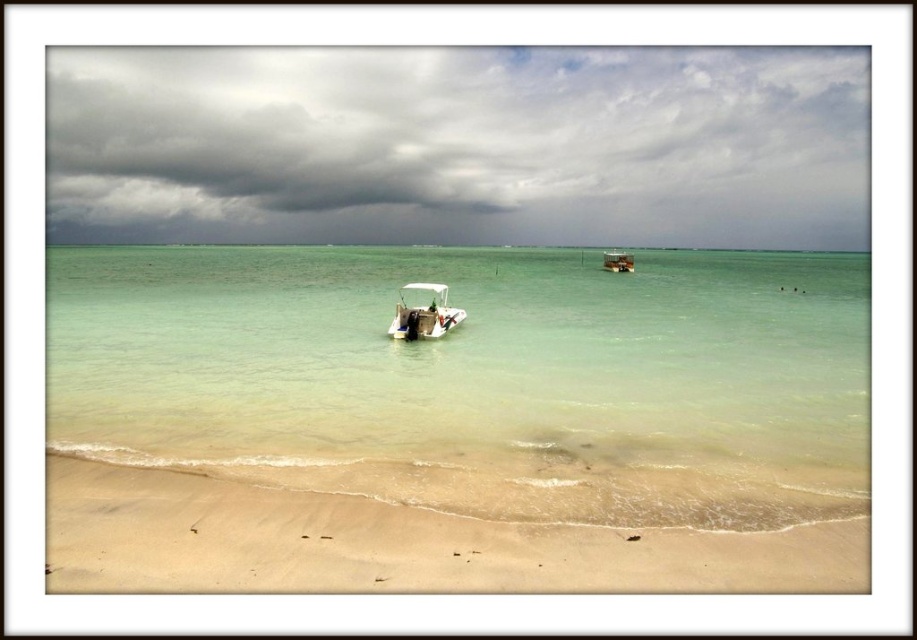
You are a photographer planning to capture the entire cloudy sky at upper center and beige sandy beach at lower center in one frame. Given that your camera can only fit objects of equal width in the shot, will you need to adjust your framing?

The cloudy sky at upper center is wider than the beige sandy beach at lower center, so you will need to adjust your framing to ensure both fit properly in the shot.

You are standing on the beach and want to take a photo of the cloudy sky at upper center and the wooden cabin boat at upper center. Since the camera you have can only focus on objects within 100 meters of each other, will both objects be in focus?

The cloudy sky at upper center is 106.15 meters from the wooden cabin boat at upper center, so the distance between them exceeds the camera focus range of 100 meters. Therefore, both objects cannot be in focus simultaneously.

In the scene shown: You are a photographer planning to capture the cloudy sky at upper center and the wooden cabin boat at upper center in a single frame. Given that your camera can only focus on one subject at a time, which subject should you prioritize to ensure it fills more of the frame?

The cloudy sky at upper center should be prioritized because it is larger in size than the wooden cabin boat at upper center, allowing it to fill more of the frame.